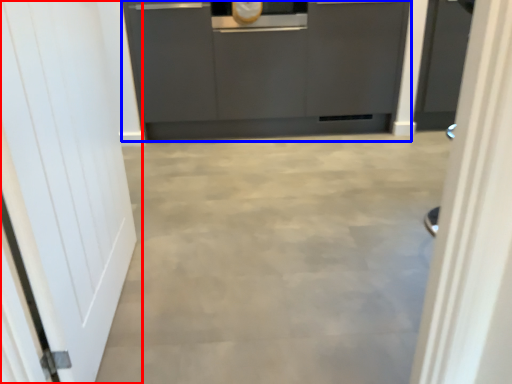
Question: Which point is closer to the camera, door (highlighted by a red box) or cabinetry (highlighted by a blue box)?

Choices:
 (A) door
 (B) cabinetry

Answer: (A)